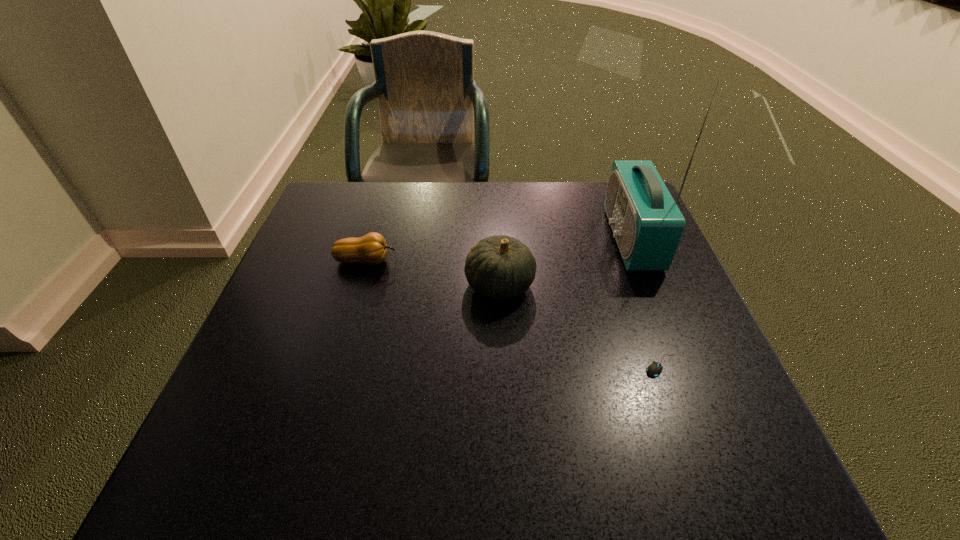
The image size is (960, 540). Identify the location of vacant point at the left edge. (277, 289).

This screenshot has width=960, height=540. I want to click on vacant space at the right edge, so click(687, 345).

Find the location of `free point between the nearest object and the radio receiver`. free point between the nearest object and the radio receiver is located at coordinates (647, 301).

Identify the location of vacant area that lies between the left gourd and the right gourd. (433, 273).

Identify the location of free space between the shortest object and the shorter gourd. Image resolution: width=960 pixels, height=540 pixels. (515, 313).

I want to click on free space between the shortest object and the tallest object, so click(647, 301).

This screenshot has height=540, width=960. I want to click on vacant point located between the mouse and the radio receiver, so click(647, 301).

I want to click on unoccupied area between the radio receiver and the right gourd, so (x=565, y=261).

You are a GUI agent. You are given a task and a screenshot of the screen. Output one action in this format:
    pyautogui.click(x=<x>, y=<y>)
    Task: Click on the vacant area between the nearest object and the tallest object
    The height and width of the screenshot is (540, 960).
    Given the screenshot: What is the action you would take?
    pyautogui.click(x=647, y=301)

Where is `free area in between the tallest object and the shortest object`? free area in between the tallest object and the shortest object is located at coordinates (647, 301).